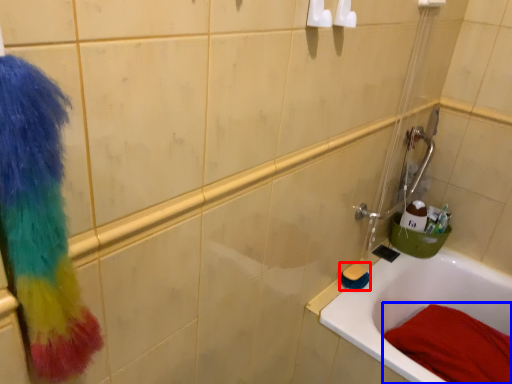
Question: Which point is further to the camera, brush (highlighted by a red box) or bath towel (highlighted by a blue box)?

Choices:
 (A) brush
 (B) bath towel

Answer: (A)